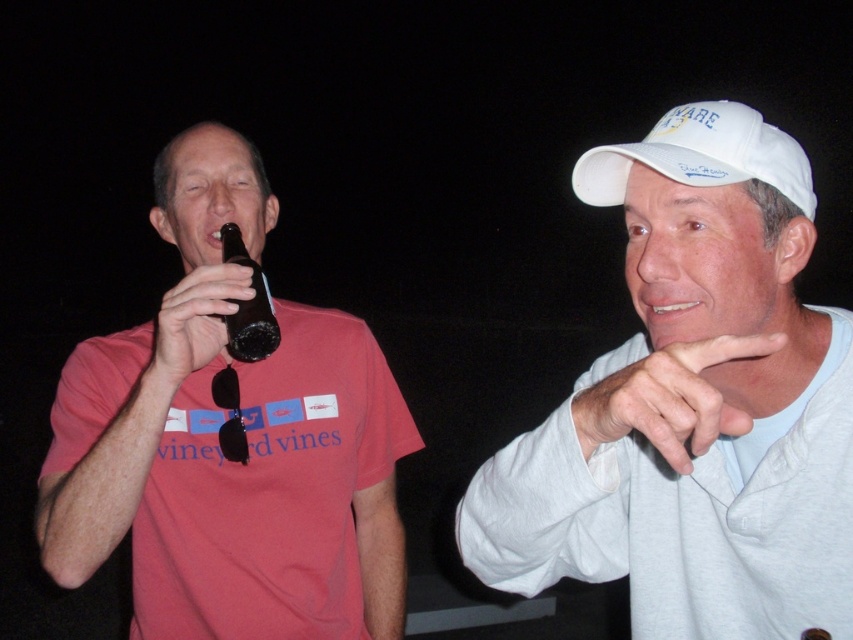
Question: Based on their relative distances, which object is farther from the matte black beer bottle at left?

Choices:
 (A) white matte cap at upper right
 (B) white fabric baseball cap at upper right
 (C) dark brown glass bottle at left

Answer: (B)

Question: Does matte black beer bottle at left appear on the right side of white fabric baseball cap at upper right?

Choices:
 (A) no
 (B) yes

Answer: (A)

Question: Does white matte cap at upper right appear on the left side of dark brown glass bottle at left?

Choices:
 (A) no
 (B) yes

Answer: (A)

Question: Where is white matte cap at upper right located in relation to dark brown glass bottle at left in the image?

Choices:
 (A) above
 (B) below

Answer: (B)

Question: Which object is closer to the camera taking this photo?

Choices:
 (A) matte black beer bottle at left
 (B) dark brown glass bottle at left
 (C) white fabric baseball cap at upper right

Answer: (C)

Question: Estimate the real-world distances between objects in this image. Which object is closer to the white matte cap at upper right?

Choices:
 (A) dark brown glass bottle at left
 (B) white fabric baseball cap at upper right

Answer: (B)